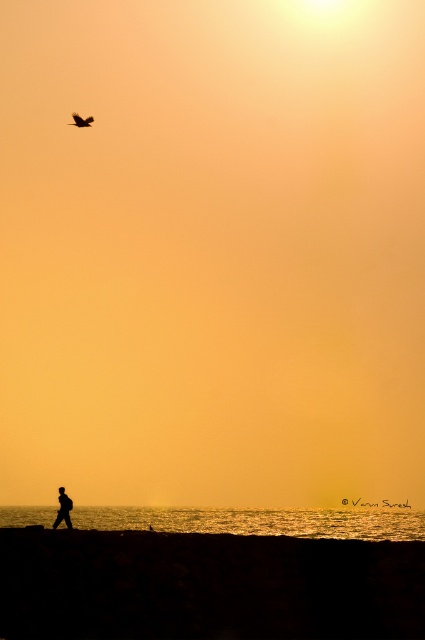
Does black silhouette person at lower left have a greater height compared to dark brown feathers at upper left?

Yes, black silhouette person at lower left is taller than dark brown feathers at upper left.

Does black silhouette person at lower left have a lesser height compared to dark brown feathers at upper left?

No, black silhouette person at lower left is not shorter than dark brown feathers at upper left.

I want to click on black silhouette person at lower left, so click(62, 509).

The image size is (425, 640). I want to click on black silhouette person at lower left, so click(62, 509).